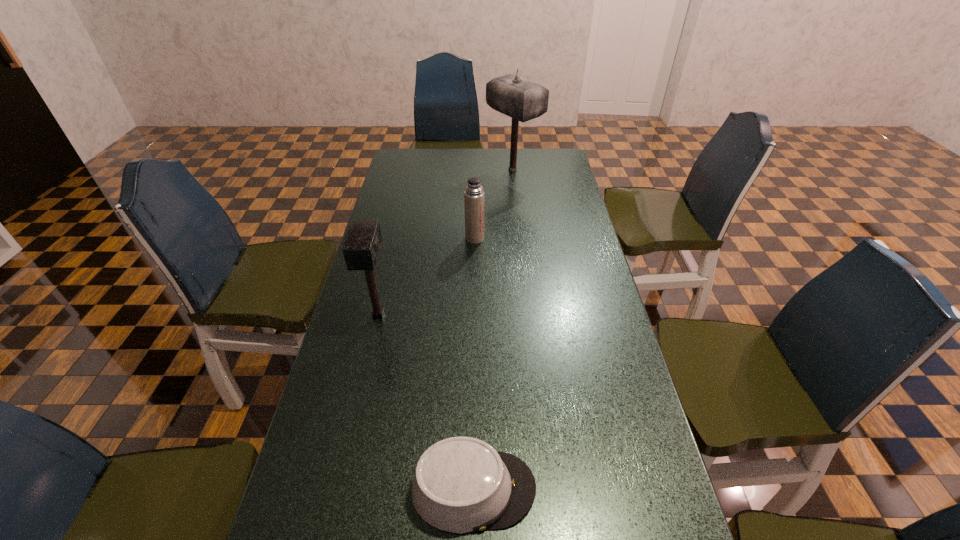
At what (x,y) coordinates should I click in order to perform the action: click on free space between the shortest object and the third tallest object. Please return your answer as a coordinate pair (x, y). Looking at the image, I should click on (474, 363).

Find the location of a particular element. unoccupied position between the hat and the taller mallet is located at coordinates (493, 329).

In order to click on free area in between the nearest object and the leftmost object in this screenshot , I will do `click(426, 402)`.

This screenshot has height=540, width=960. In order to click on free space between the third nearest object and the hat in this screenshot , I will do `click(474, 363)`.

Locate which object ranks in proximity to the shortest object. Please provide its 2D coordinates. Your answer should be formatted as a tuple, i.e. [(x, y)], where the tuple contains the x and y coordinates of a point satisfying the conditions above.

[(362, 245)]

The image size is (960, 540). In order to click on object that can be found as the closest to the right mallet in this screenshot , I will do `click(474, 194)`.